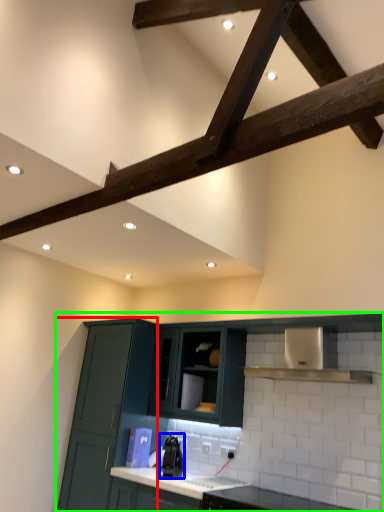
Question: Which is farther away from cabinetry (highlighted by a red box)? appliance (highlighted by a blue box) or cabinetry (highlighted by a green box)?

Choices:
 (A) appliance
 (B) cabinetry

Answer: (A)